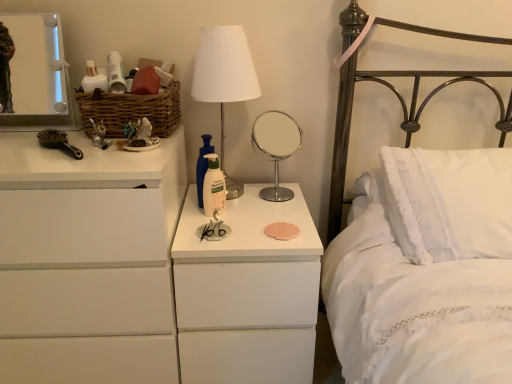
Find the location of a particular element. Image resolution: width=512 pixels, height=384 pixels. free spot to the right of black plastic brush at left is located at coordinates (111, 157).